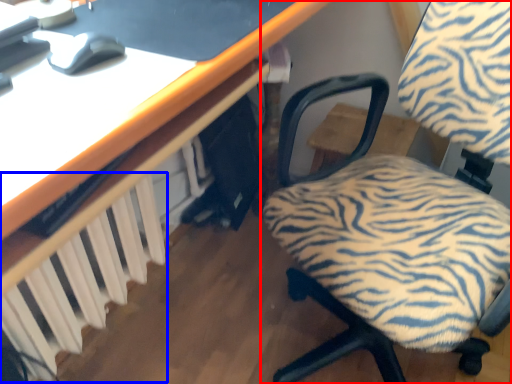
Question: Among these objects, which one is nearest to the camera, chair (highlighted by a red box) or radiator (highlighted by a blue box)?

Choices:
 (A) chair
 (B) radiator

Answer: (A)